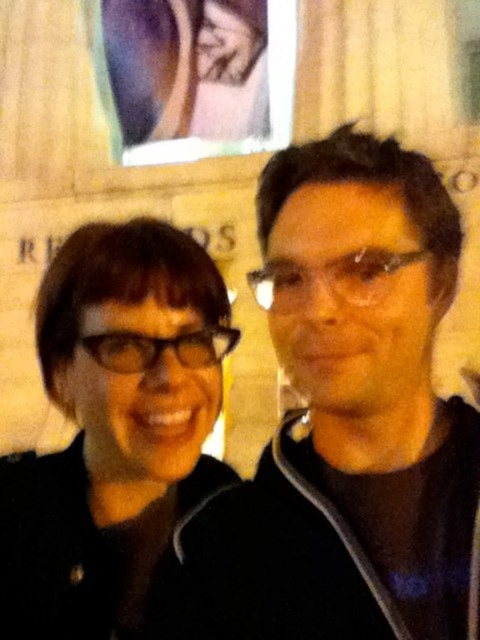
You are a photographer trying to focus on the glasses of the two people in the image. Which pair of glasses is positioned higher on their face between the matte black glasses at center and the black plastic glasses at center?

The matte black glasses at center is above the black plastic glasses at center, so the matte black glasses at center is positioned higher on their face.

You are a photographer adjusting your camera settings. The matte black glasses at center are your focus point. If you want to ensure the glasses are in sharp focus, what distance should your camera be set to?

The matte black glasses at center is 2.19 meters from camera, so the camera should be set to a focus distance of 2.19 meters to ensure sharpness.